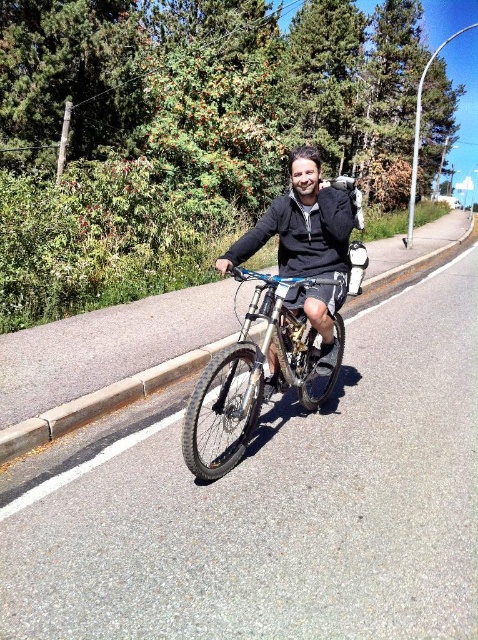
Question: Among these points, which one is nearest to the camera?

Choices:
 (A) (229, 445)
 (B) (317, 323)

Answer: (B)

Question: Considering the relative positions of shiny metallic bicycle at center and black matte jacket at center in the image provided, where is shiny metallic bicycle at center located with respect to black matte jacket at center?

Choices:
 (A) right
 (B) left

Answer: (B)

Question: Among these points, which one is farthest from the camera?

Choices:
 (A) (206, 365)
 (B) (276, 230)

Answer: (A)

Question: Can you confirm if shiny metallic bicycle at center is positioned below black matte jacket at center?

Choices:
 (A) no
 (B) yes

Answer: (B)

Question: Is shiny metallic bicycle at center closer to the viewer compared to black matte jacket at center?

Choices:
 (A) no
 (B) yes

Answer: (B)